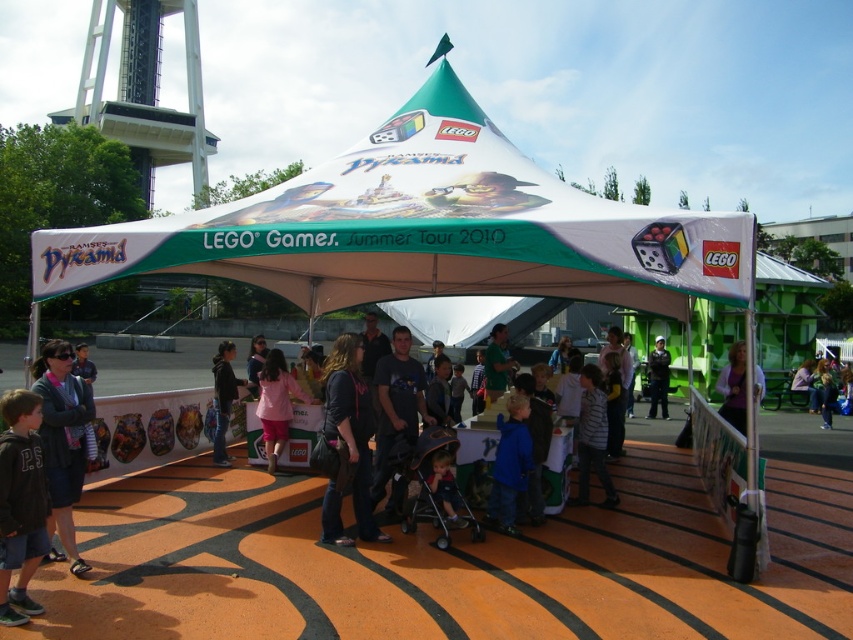
Between dark gray t-shirt at center and green matte shirt at center, which one has more height?

Standing taller between the two is green matte shirt at center.

Is point (407, 442) behind point (498, 387)?

No, (407, 442) is in front of (498, 387).

The height and width of the screenshot is (640, 853). Identify the location of dark gray t-shirt at center. (396, 404).

Does white fabric canopy at center appear on the left side of dark gray hoodie at center?

No, white fabric canopy at center is not to the left of dark gray hoodie at center.

Which is behind, point (96, 252) or point (219, 355)?

Positioned behind is point (219, 355).

Who is more forward, (x=547, y=228) or (x=225, y=362)?

Point (x=547, y=228) is in front.

The height and width of the screenshot is (640, 853). Find the location of `white fabric canopy at center`. white fabric canopy at center is located at coordinates (424, 228).

Who is higher up, dark gray hoodie at lower left or dark gray t-shirt at center?

dark gray t-shirt at center is higher up.

Who is positioned more to the right, dark gray hoodie at lower left or dark gray t-shirt at center?

dark gray t-shirt at center is more to the right.

At what (x,y) coordinates should I click in order to perform the action: click on dark gray hoodie at lower left. Please return your answer as a coordinate pair (x, y). This screenshot has width=853, height=640. Looking at the image, I should click on (20, 504).

Image resolution: width=853 pixels, height=640 pixels. I want to click on dark gray hoodie at lower left, so click(20, 504).